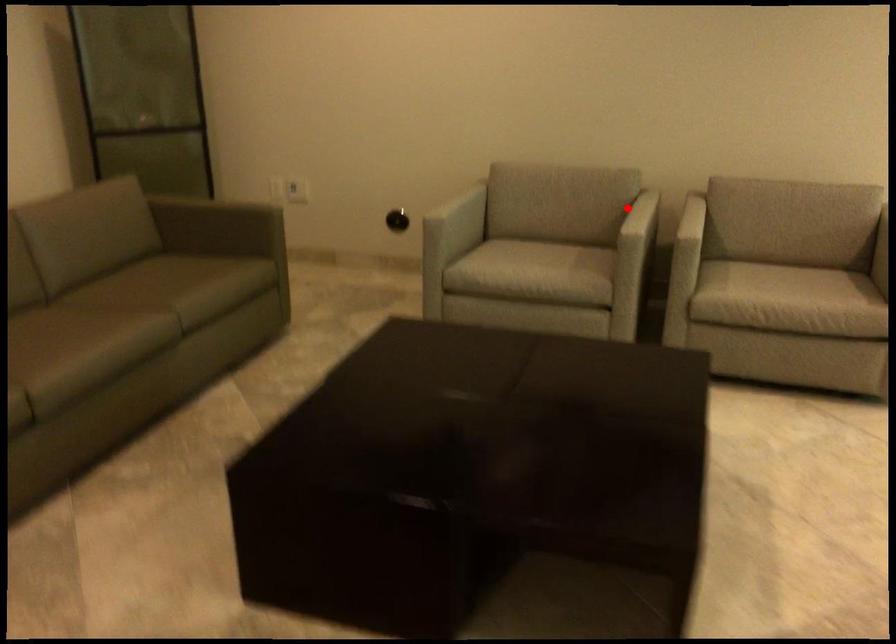
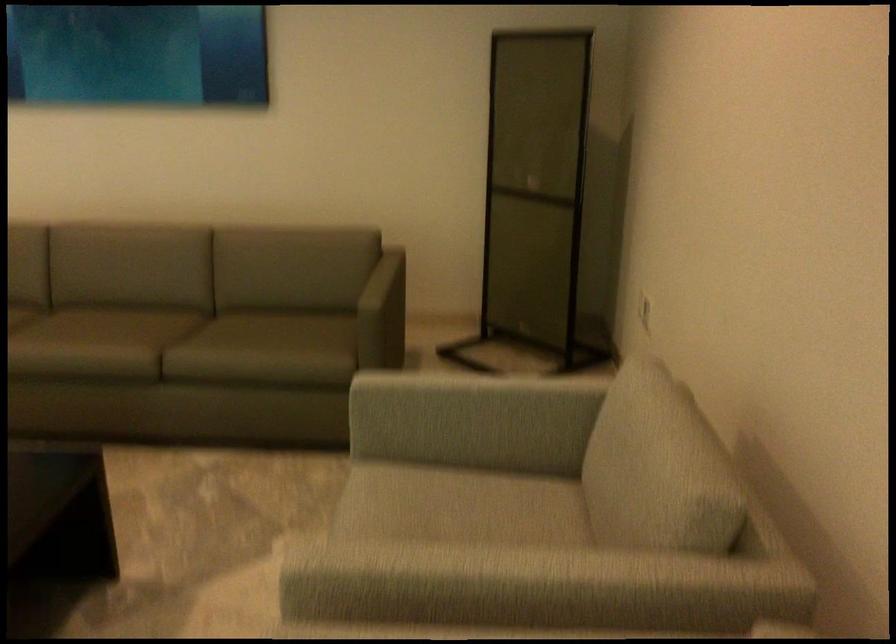
Question: I am providing you with two images of the same scene from different viewpoints. Image1 has a red point marked. In image2, the corresponding 3D location appears at what relative position? Reply with the corresponding letter.

Choices:
 (A) Closer
 (B) Farther

Answer: (A)